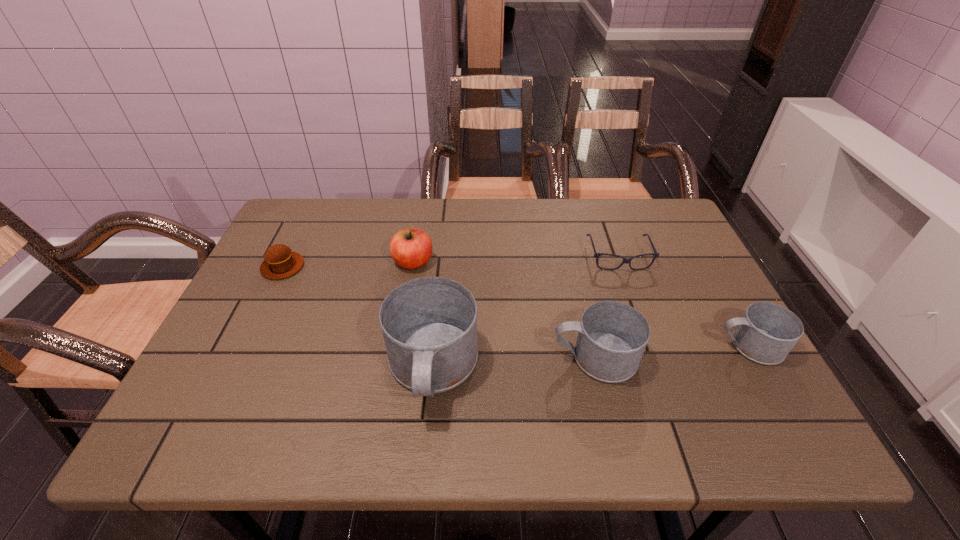
With all mugs evenly spaced, where should an extra mug be placed on the left to continue the pattern? Please point out a vacant space. Please provide its 2D coordinates. Your answer should be formatted as a tuple, i.e. [(x, y)], where the tuple contains the x and y coordinates of a point satisfying the conditions above.

[(262, 382)]